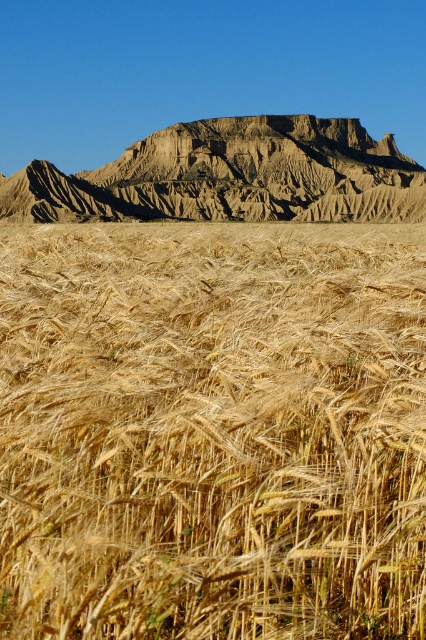
Question: Which point is closer to the camera?

Choices:
 (A) (199, 168)
 (B) (213, 369)

Answer: (B)

Question: Where is golden wheat field at center located in relation to rugged brown rock formation at upper center in the image?

Choices:
 (A) left
 (B) right

Answer: (A)

Question: Which object appears farthest from the camera in this image?

Choices:
 (A) golden wheat field at center
 (B) rugged brown rock formation at upper center

Answer: (B)

Question: Where is golden wheat field at center located in relation to rugged brown rock formation at upper center in the image?

Choices:
 (A) below
 (B) above

Answer: (A)

Question: Is golden wheat field at center behind rugged brown rock formation at upper center?

Choices:
 (A) yes
 (B) no

Answer: (B)